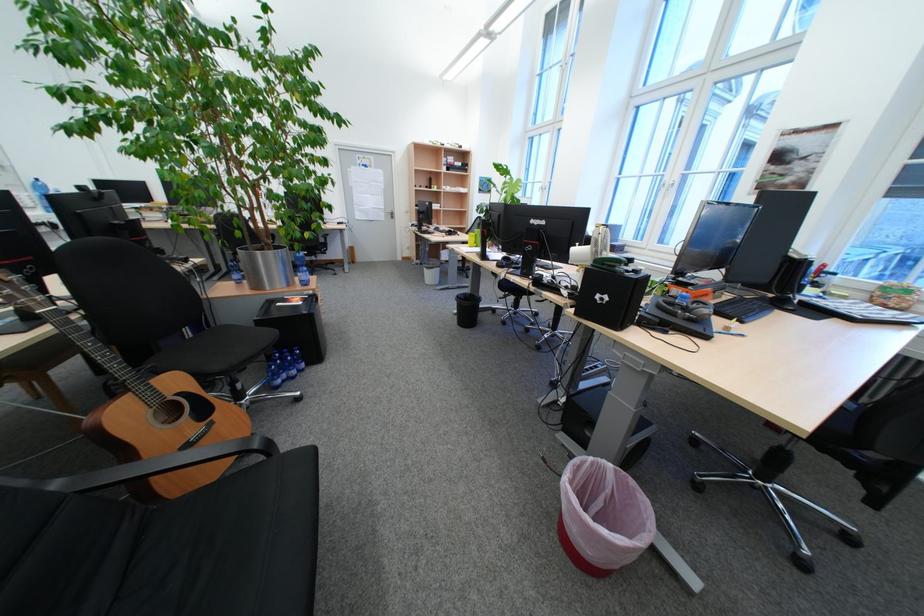
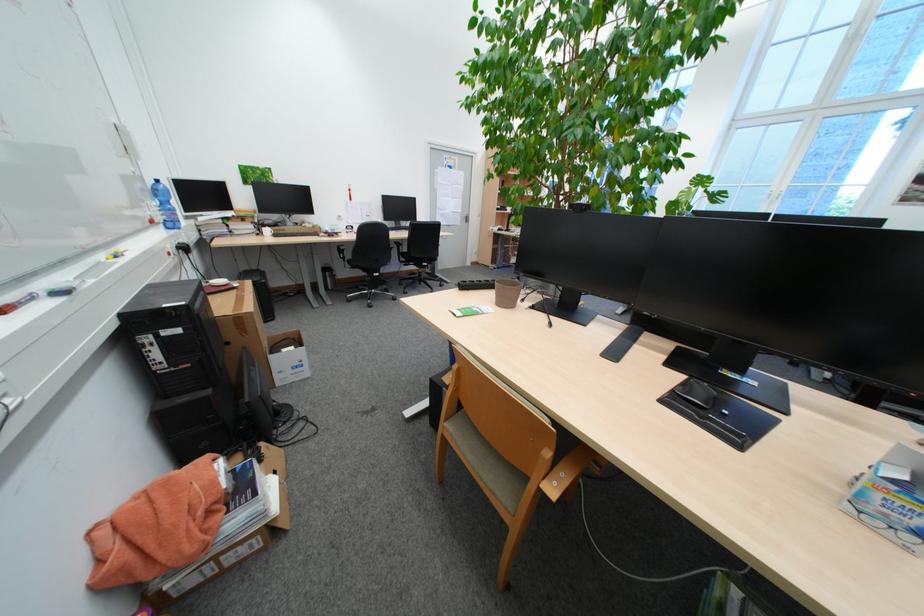
Question: The images are taken continuously from a first-person perspective. In which direction are you moving?

Choices:
 (A) Left
 (B) Right
 (C) Forward
 (D) Backward

Answer: (A)